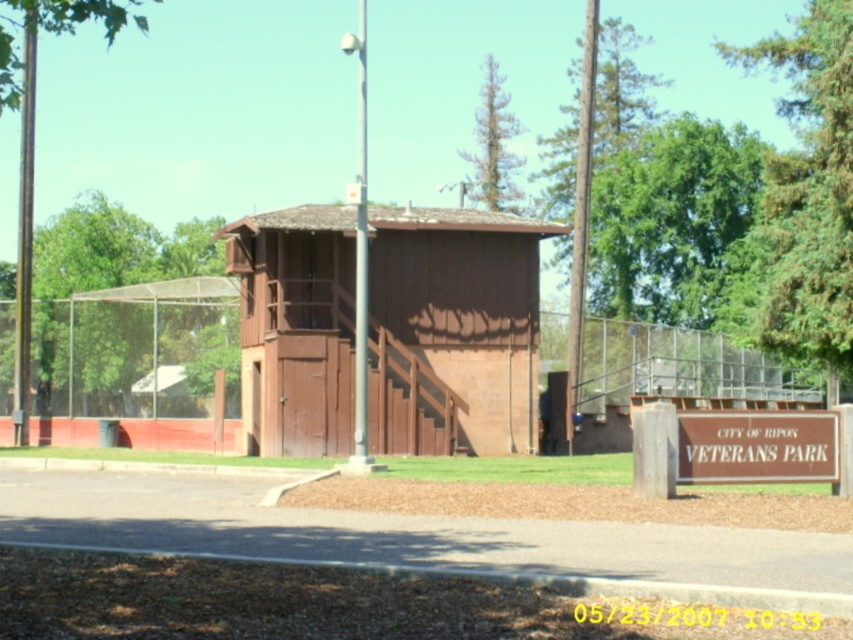
Can you confirm if green leafy tree at upper right is taller than brown wooden sign at lower right?

Yes.

Is green leafy tree at upper right to the left of brown wooden sign at lower right from the viewer's perspective?

In fact, green leafy tree at upper right is to the right of brown wooden sign at lower right.

Which is behind, point (848, 104) or point (764, 460)?

The point (848, 104) is behind.

Where is `green leafy tree at upper right`? Image resolution: width=853 pixels, height=640 pixels. green leafy tree at upper right is located at coordinates (809, 193).

Does clear plastic fence at left lie in front of brown wooden fence at center?

That is False.

At what (x,y) coordinates should I click in order to perform the action: click on clear plastic fence at left. Please return your answer as a coordinate pair (x, y). The width and height of the screenshot is (853, 640). Looking at the image, I should click on (142, 365).

The height and width of the screenshot is (640, 853). Identify the location of clear plastic fence at left. (142, 365).

Does brown wood hut at center have a lesser width compared to clear plastic fence at left?

Incorrect, brown wood hut at center's width is not less than clear plastic fence at left's.

Between brown wood hut at center and clear plastic fence at left, which one is positioned lower?

Positioned lower is clear plastic fence at left.

Is point (422, 230) more distant than point (131, 305)?

No, (422, 230) is in front of (131, 305).

The height and width of the screenshot is (640, 853). Find the location of `brown wood hut at center`. brown wood hut at center is located at coordinates (451, 328).